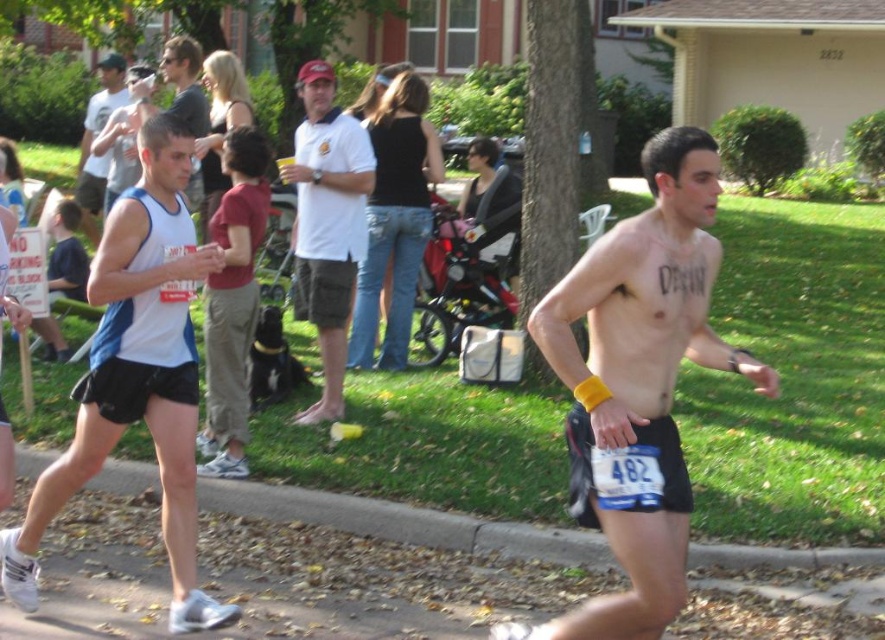
Consider the image. You are a runner participating in the marathon and currently at the point with coordinates point (309, 317). You need to reach the point (91, 163) as soon as possible. What direction should you move in?

You should move backward because point (309, 317) is in front of point (91, 163), so moving backward will bring you closer to the desired point.

You are a photographer at the marathon event. You need to capture a photo that includes both the white cotton shirt at center and the matte white tank top at left. Based on their positions, which one should you focus on first to ensure both are in the frame?

The white cotton shirt at center is located below the matte white tank top at left, so you should focus on the matte white tank top at left first to ensure both are in the frame.